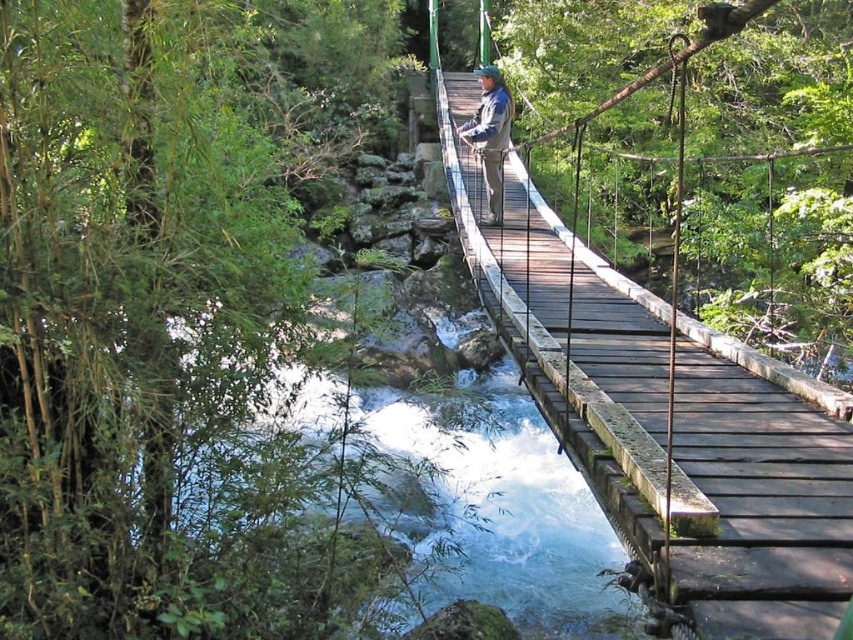
You are a hiker who has just reached the wooden bridge at center and notices a blue denim jacket at center nearby. Which object takes up more space in the image?

The wooden bridge at center is bigger than the blue denim jacket at center, so the wooden bridge at center takes up more space in the image.

You are a hiker standing on the wooden bridge at center and you notice a blue denim jacket at center nearby. Which object is higher from the ground?

The wooden bridge at center is much taller than the blue denim jacket at center, so the wooden bridge at center is higher from the ground.

You are standing on the wooden bridge at center and see a blue denim jacket at center. Which object is closer to you?

The wooden bridge at center is closer to you than the blue denim jacket at center.